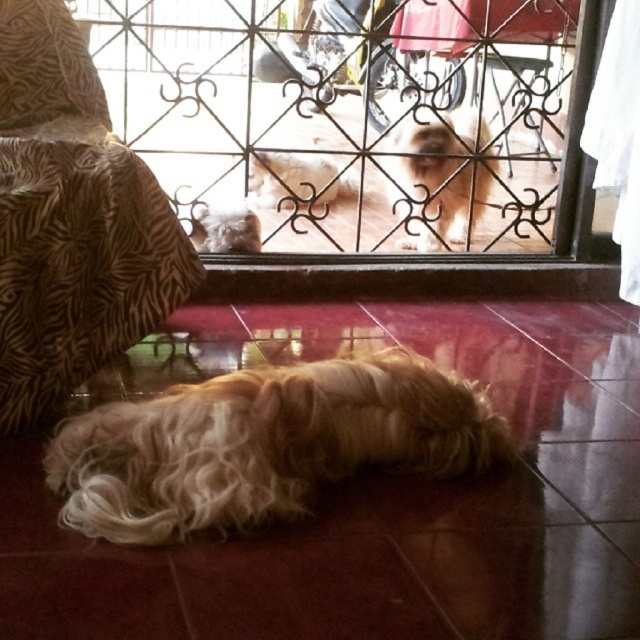
From the picture: Can you confirm if fluffy golden dog at lower center is positioned below white fluffy dog at center?

Correct, fluffy golden dog at lower center is located below white fluffy dog at center.

Which is in front, point (449, 404) or point (321, 157)?

Point (449, 404)

The image size is (640, 640). I want to click on fluffy golden dog at lower center, so click(x=264, y=444).

Is clear glass door at center thinner than white fluffy dog at upper center?

No, clear glass door at center is not thinner than white fluffy dog at upper center.

Does clear glass door at center have a greater width compared to white fluffy dog at upper center?

Yes, clear glass door at center is wider than white fluffy dog at upper center.

What are the coordinates of `clear glass door at center` in the screenshot? It's located at (353, 115).

Identify the location of clear glass door at center. (353, 115).

This screenshot has width=640, height=640. Describe the element at coordinates (296, 180) in the screenshot. I see `white fluffy dog at center` at that location.

Where is `white fluffy dog at center`? The width and height of the screenshot is (640, 640). white fluffy dog at center is located at coordinates (296, 180).

This screenshot has width=640, height=640. In order to click on white fluffy dog at center in this screenshot , I will do `click(296, 180)`.